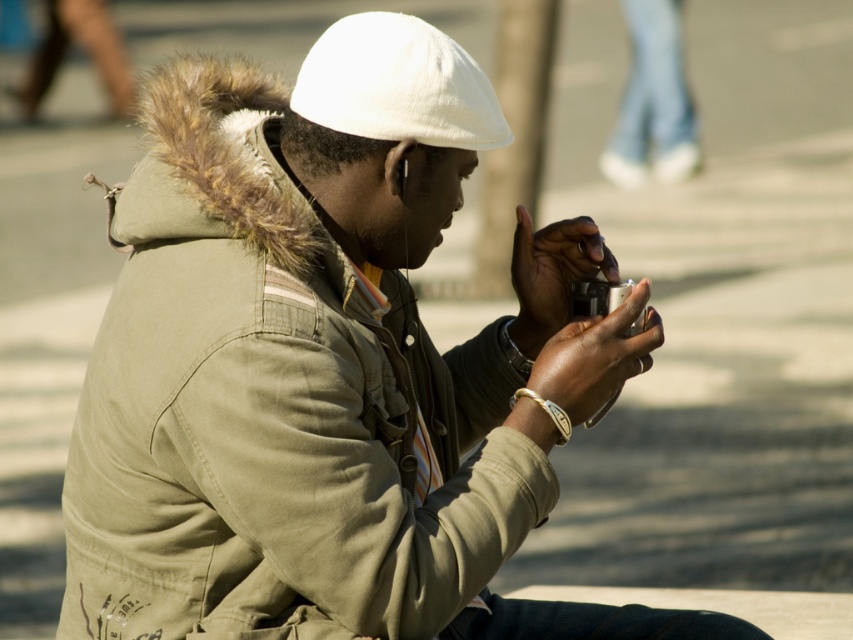
Question: Is white fabric hat at upper center positioned before silver metallic camera at center?

Choices:
 (A) yes
 (B) no

Answer: (A)

Question: Which point appears closest to the camera in this image?

Choices:
 (A) (416, 51)
 (B) (619, 300)

Answer: (A)

Question: Is white fabric hat at upper center to the right of silver metallic camera at center from the viewer's perspective?

Choices:
 (A) yes
 (B) no

Answer: (B)

Question: Can you confirm if white fabric hat at upper center is positioned to the left of silver metallic camera at center?

Choices:
 (A) yes
 (B) no

Answer: (A)